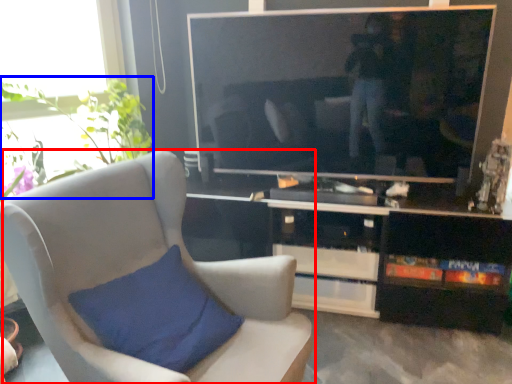
Question: Which point is further to the camera, chair (highlighted by a red box) or plant (highlighted by a blue box)?

Choices:
 (A) chair
 (B) plant

Answer: (B)